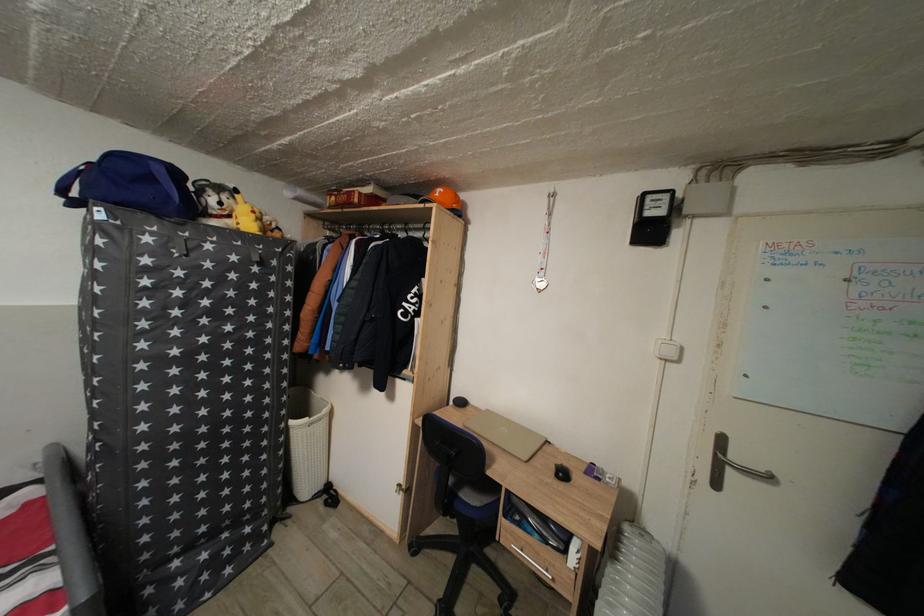
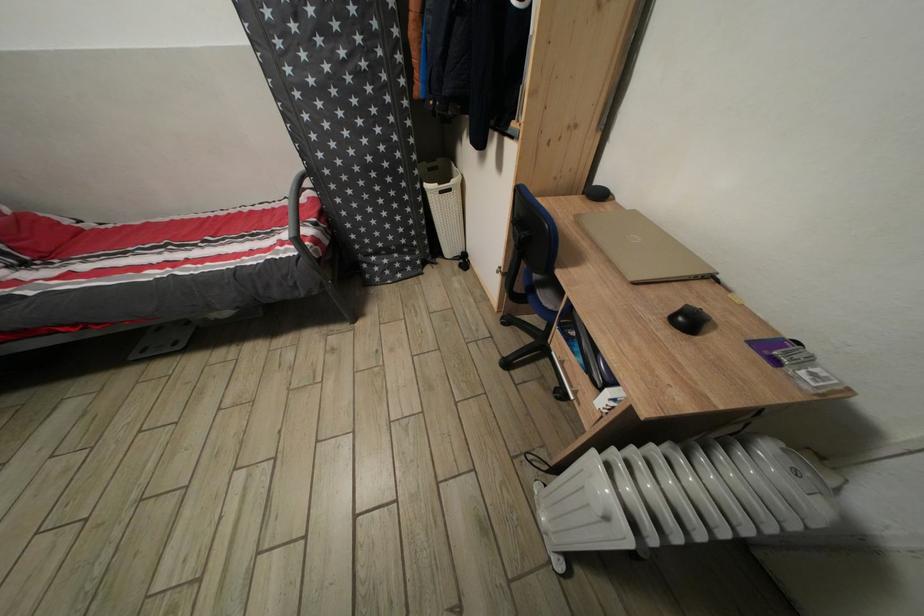
Where in the second image is the point corresponding to the point at 180,469 from the first image?

(357, 198)